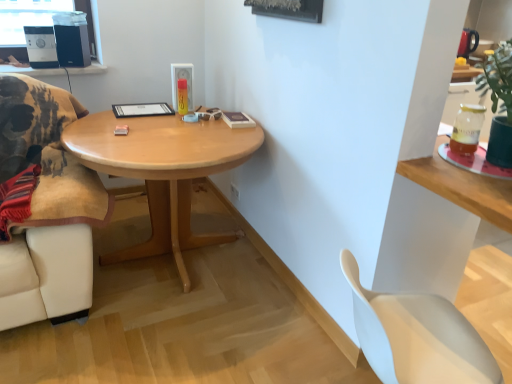
The image size is (512, 384). Find the location of `vacant point above black matte speaker at upper left, which is the first speaker from right to left (from a real-world perspective)`. vacant point above black matte speaker at upper left, which is the first speaker from right to left (from a real-world perspective) is located at coordinates (73, 18).